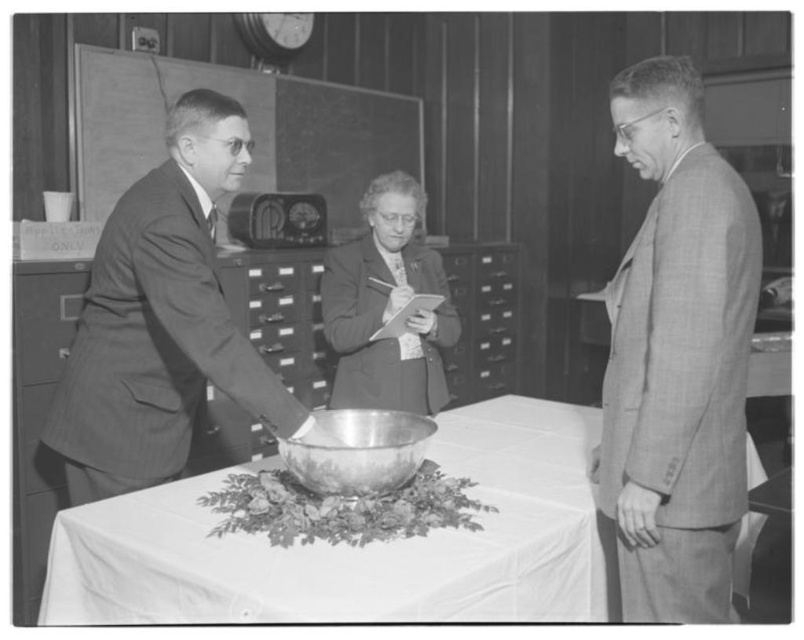
You are standing in the room and want to hand a document to the person wearing the checkered wool suit at right. However, there is a silver metallic bowl at center on the table between you and them. Can you reach them without moving the bowl?

The checkered wool suit at right is closer to the viewer than the silver metallic bowl at center, so you can reach them without moving the bowl because the person is in front of the bowl.

Looking at this image, you are standing in the room and want to hand a document to the person wearing the checkered wool suit at right. The document is currently on the silver metallic bowl at center. Can you directly hand it to them without moving the bowl?

The checkered wool suit at right is located above the silver metallic bowl at center, so the person is already positioned above the bowl. Therefore, they can reach the document on the silver metallic bowl at center without needing to move the bowl.

You are standing in the room and want to walk towards the checkered wool suit at right. Which direction should you move relative to your current position?

Since the checkered wool suit at right is located at coordinate point 0.558 on the x axis and 0.842 on the y axis, you should move towards the right and slightly forward to reach it.